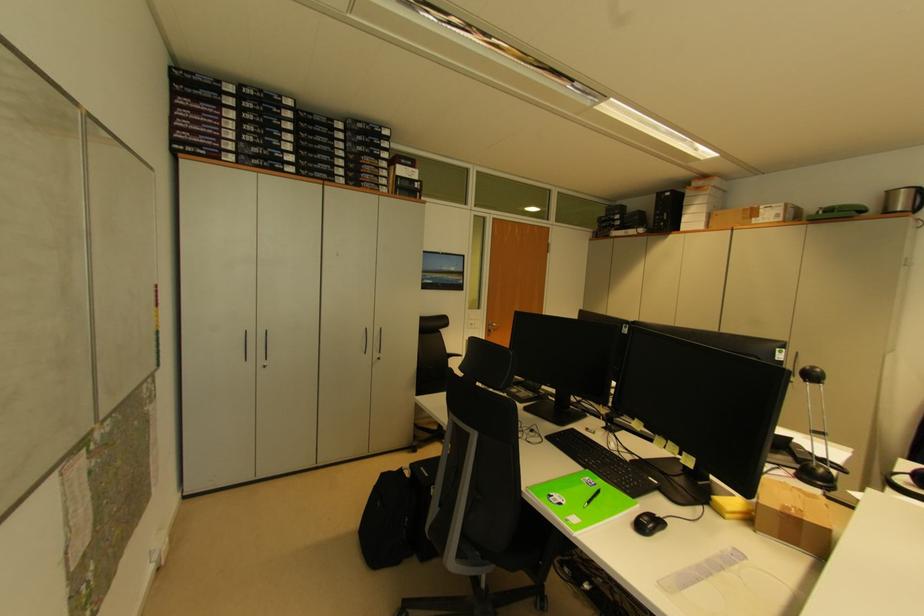
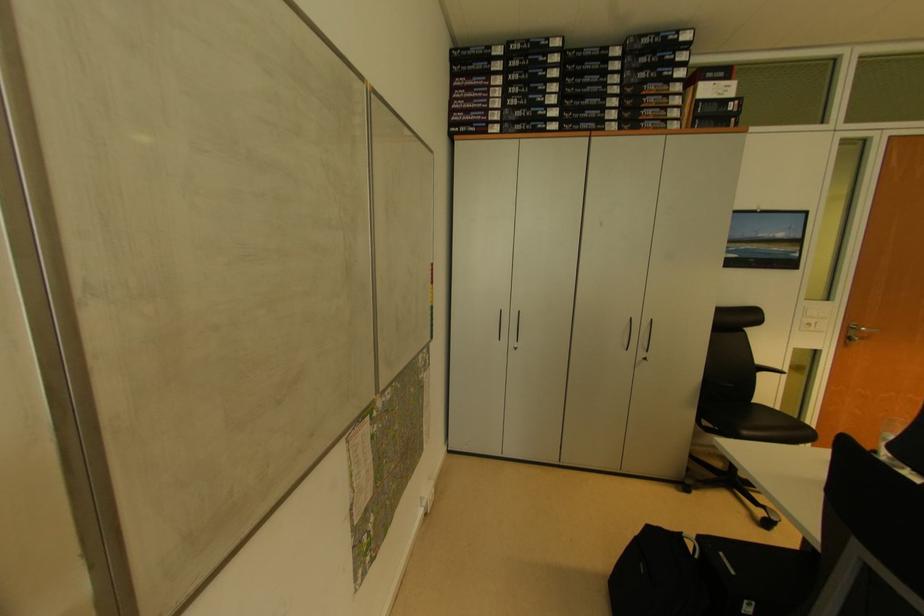
In the second image, find the point that corresponds to the point at 451,354 in the first image.

(761, 363)